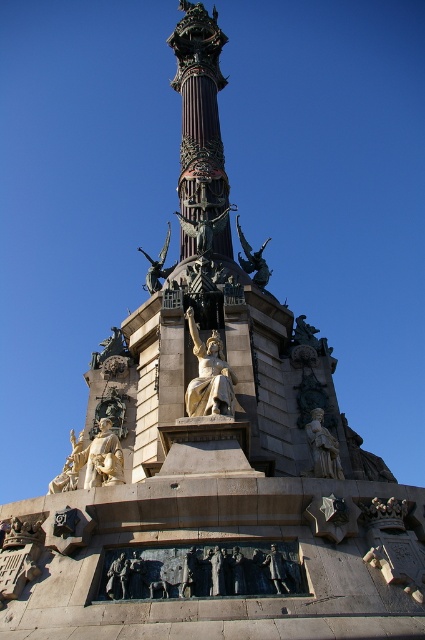
Does polished bronze statue at center have a greater height compared to bronze statue at center?

No, polished bronze statue at center is not taller than bronze statue at center.

Is polished bronze statue at center bigger than bronze statue at center?

No, polished bronze statue at center is not bigger than bronze statue at center.

Measure the distance between point (314, 442) and camera.

Point (314, 442) is 51.01 meters from camera.

This screenshot has width=425, height=640. In order to click on polished bronze statue at center in this screenshot , I will do 323,448.

Measure the distance between gold polished statue at center and bronze statue at center.

25.83 meters

Between point (206, 394) and point (167, 268), which one is positioned in front?

Point (206, 394) is in front.

The height and width of the screenshot is (640, 425). Identify the location of gold polished statue at center. (209, 376).

What do you see at coordinates (209, 376) in the screenshot? The width and height of the screenshot is (425, 640). I see `gold polished statue at center` at bounding box center [209, 376].

You are a GUI agent. You are given a task and a screenshot of the screen. Output one action in this format:
    pyautogui.click(x=<x>, y=<y>)
    Task: Click on the gold polished statue at center
    The width and height of the screenshot is (425, 640).
    Given the screenshot: What is the action you would take?
    pyautogui.click(x=209, y=376)